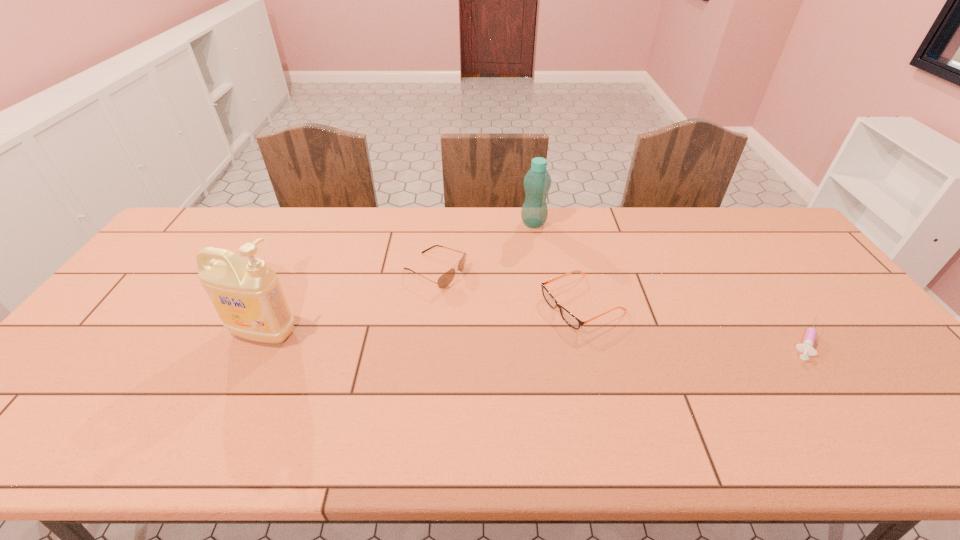
Identify the location of free spot that satisfies the following two spatial constraints: 1. on the back side of the leftmost object; 2. on the right side of the third shortest object. This screenshot has height=540, width=960. (293, 272).

Where is `free spot that satisfies the following two spatial constraints: 1. on the back side of the detergent; 2. on the right side of the farthest object`? This screenshot has height=540, width=960. free spot that satisfies the following two spatial constraints: 1. on the back side of the detergent; 2. on the right side of the farthest object is located at coordinates (316, 223).

Locate an element on the screen. Image resolution: width=960 pixels, height=540 pixels. vacant space that satisfies the following two spatial constraints: 1. on the front side of the fourth shortest object; 2. on the left side of the spectacles is located at coordinates (546, 303).